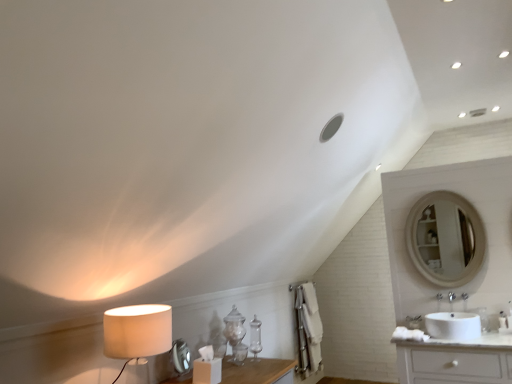
Question: From the image's perspective, is white glossy sink at lower right positioned above or below beige fabric lampshade at left?

Choices:
 (A) below
 (B) above

Answer: (A)

Question: Is white glossy sink at lower right inside the boundaries of beige fabric lampshade at left, or outside?

Choices:
 (A) inside
 (B) outside

Answer: (B)

Question: Is white glossy sink at lower right in front of or behind beige fabric lampshade at left in the image?

Choices:
 (A) behind
 (B) front

Answer: (A)

Question: In terms of height, does beige fabric lampshade at left look taller or shorter compared to white glossy sink at lower right?

Choices:
 (A) tall
 (B) short

Answer: (A)

Question: Is beige fabric lampshade at left wider or thinner than white glossy sink at lower right?

Choices:
 (A) wide
 (B) thin

Answer: (B)

Question: In the image, is beige fabric lampshade at left on the left side or the right side of white glossy sink at lower right?

Choices:
 (A) right
 (B) left

Answer: (B)

Question: Is beige fabric lampshade at left bigger or smaller than white glossy sink at lower right?

Choices:
 (A) small
 (B) big

Answer: (B)